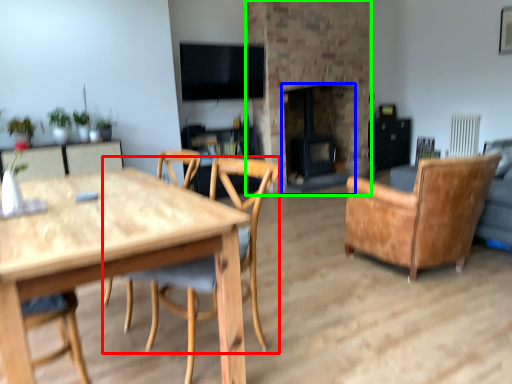
Question: Which is farther away from chair (highlighted by a red box)? fireplace (highlighted by a blue box) or fireplace (highlighted by a green box)?

Choices:
 (A) fireplace
 (B) fireplace

Answer: (B)